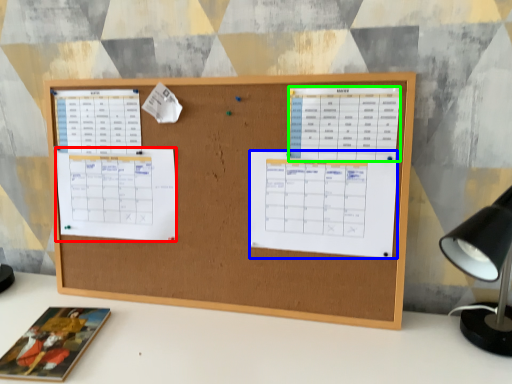
Question: Which object is the closest to the list (highlighted by a red box)? Choose among these: list (highlighted by a blue box) or list (highlighted by a green box).

Choices:
 (A) list
 (B) list

Answer: (A)